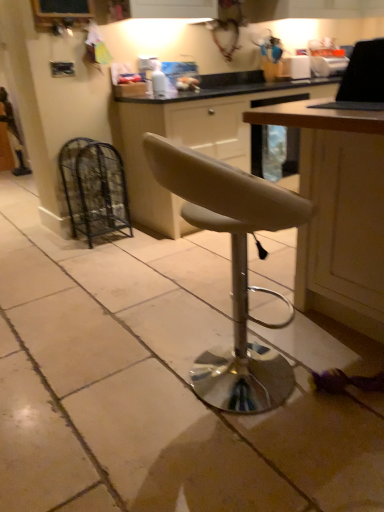
Locate an element on the screen. vacant space in front of beige leather stool at center is located at coordinates (246, 469).